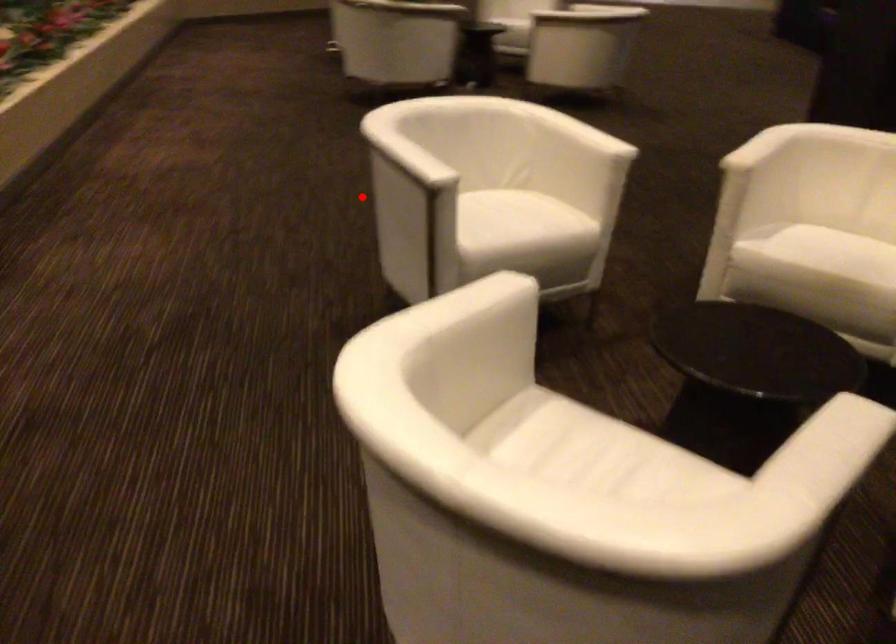
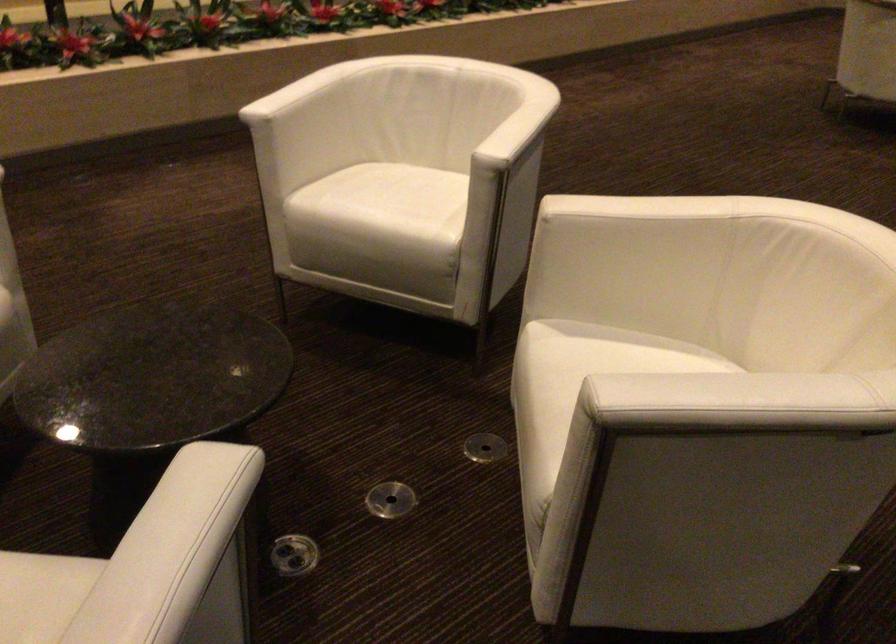
Find the pixel in the second image that matches the highlighted location in the first image.

(571, 180)